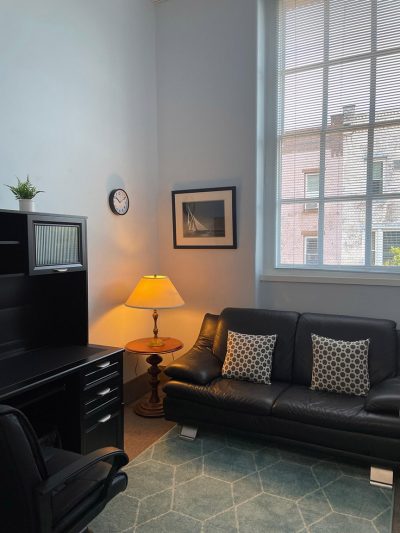
Where is `desk`? desk is located at coordinates (52, 359).